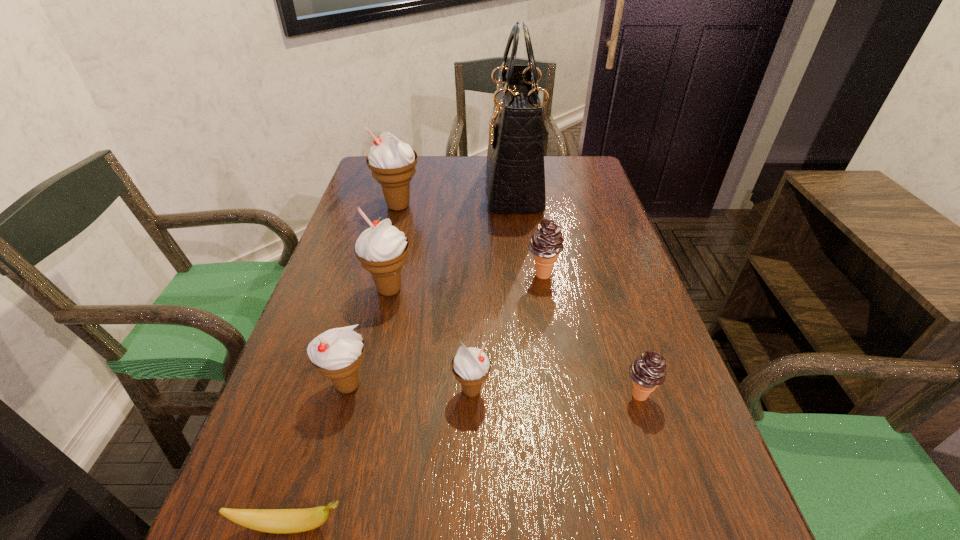
You are a GUI agent. You are given a task and a screenshot of the screen. Output one action in this format:
    pyautogui.click(x=<x>, y=<y>)
    Task: Click on the vacant area between the fourth object from right to left and the nearer chocolate icecream
    
    Given the screenshot: What is the action you would take?
    pyautogui.click(x=555, y=393)

At what (x,y) coordinates should I click in order to perform the action: click on free space between the second tallest icecream and the smaller chocolate icecream. Please return your answer as a coordinate pair (x, y). Image resolution: width=960 pixels, height=540 pixels. Looking at the image, I should click on (515, 342).

Identify which object is located as the second nearest to the smaller chocolate icecream. Please provide its 2D coordinates. Your answer should be formatted as a tuple, i.e. [(x, y)], where the tuple contains the x and y coordinates of a point satisfying the conditions above.

[(546, 243)]

The height and width of the screenshot is (540, 960). In order to click on object that is the seventh closest one to the bigger chocolate icecream in this screenshot , I will do `click(279, 521)`.

Locate an element on the screen. Image resolution: width=960 pixels, height=540 pixels. icecream that is the closest to the handbag is located at coordinates (392, 163).

Identify which icecream is located as the third nearest to the third biggest white icecream. Please provide its 2D coordinates. Your answer should be formatted as a tuple, i.e. [(x, y)], where the tuple contains the x and y coordinates of a point satisfying the conditions above.

[(546, 243)]

Locate an element on the screen. The width and height of the screenshot is (960, 540). white icecream object that ranks as the closest to the farthest white icecream is located at coordinates (382, 249).

Find the location of `white icecream that is the closest to the banana`. white icecream that is the closest to the banana is located at coordinates (337, 353).

I want to click on free spot that satisfies the following two spatial constraints: 1. on the front side of the nearer chocolate icecream; 2. at the stem of the shortest object, so click(680, 525).

The width and height of the screenshot is (960, 540). I want to click on free spot that satisfies the following two spatial constraints: 1. on the front side of the smaller chocolate icecream; 2. on the left side of the fifth object from left to right, so click(x=471, y=394).